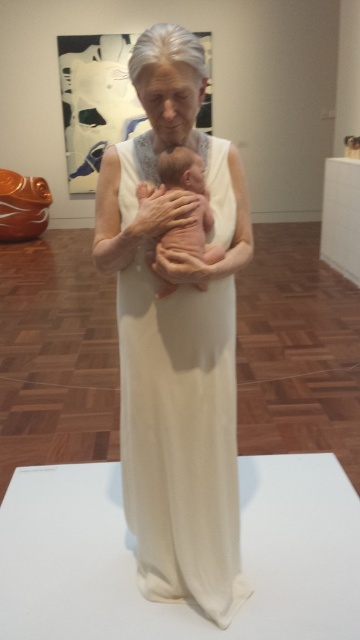
From the picture: You are an art restorer standing 5 feet away from the sculpture of an elderly woman holding a baby. You need to clean the white matte dress at center. Do you think you can reach it from your current position without moving closer?

The white matte dress at center and viewer are 4.23 feet apart. Since you are standing 5 feet away, you are slightly farther than the required distance. To reach the dress, you would need to move closer to within 4.23 feet or less.

Consider the image. You are standing in an art gallery and want to take a photo of the sculpture of an elderly woman holding a baby. The camera you are using has a maximum focus range of 5 feet. Can you focus on the point at coordinates point (145,467) without moving closer?

The point (145,467) is 5.07 feet away from the camera, which is slightly beyond the camera maximum focus range of 5 feet. Therefore, you cannot focus on the point at coordinates point (145,467) without moving closer.

You are an art student analyzing the sculpture. You notice the white matte dress at center and the pink matte baby at center. Which object is closer to you in the sculpture?

The white matte dress at center is closer to you than the pink matte baby at center because it is positioned further to the viewer.